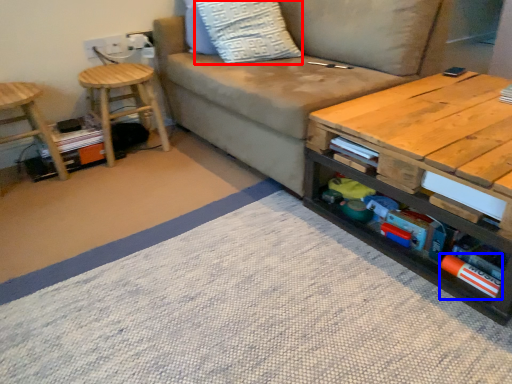
Question: Which of the following is the farthest to the observer, throw pillow (highlighted by a red box) or book (highlighted by a blue box)?

Choices:
 (A) throw pillow
 (B) book

Answer: (A)